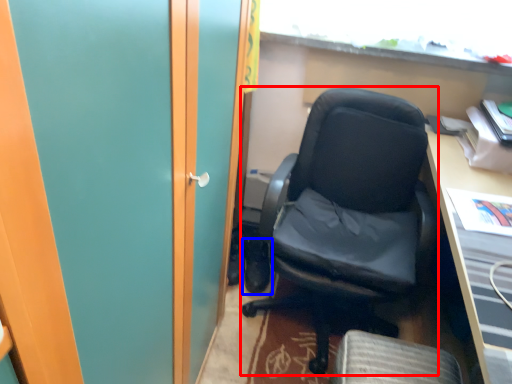
Question: Which point is further to the camera, chair (highlighted by a red box) or footwear (highlighted by a blue box)?

Choices:
 (A) chair
 (B) footwear

Answer: (B)